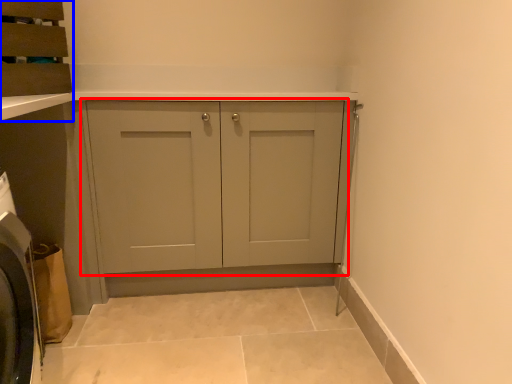
Question: Among these objects, which one is nearest to the camera, cupboard (highlighted by a red box) or cabinetry (highlighted by a blue box)?

Choices:
 (A) cupboard
 (B) cabinetry

Answer: (B)